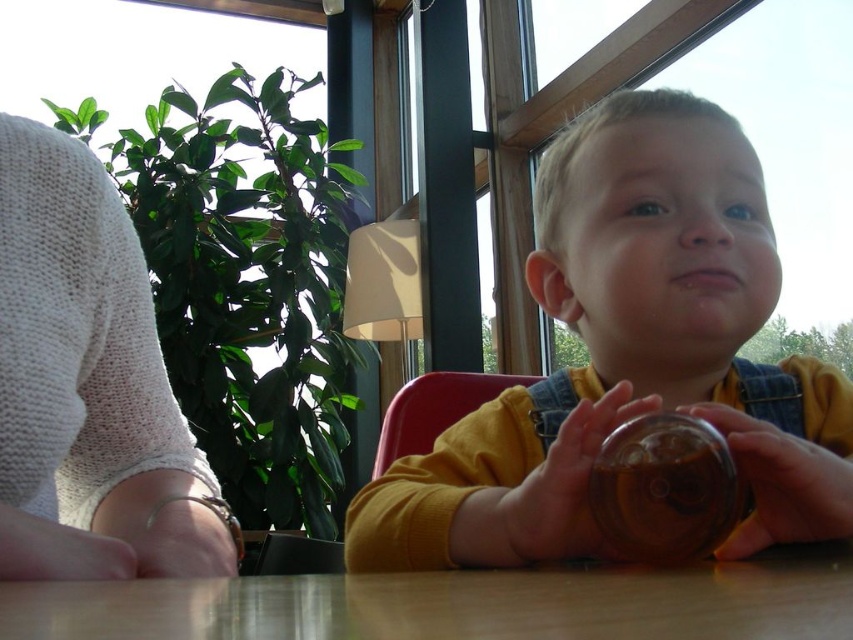
Which of these two, wooden table at center or translucent plastic cup at lower center, stands taller?

translucent plastic cup at lower center is taller.

Is point (80, 595) positioned in front of point (693, 497)?

Yes, point (80, 595) is in front of point (693, 497).

Is point (49, 586) positioned behind point (608, 470)?

No, (49, 586) is closer to viewer.

Locate an element on the screen. wooden table at center is located at coordinates (460, 604).

Based on the photo, does matte yellow shirt at center appear over red plastic chair at center?

Yes, matte yellow shirt at center is above red plastic chair at center.

This screenshot has height=640, width=853. Describe the element at coordinates (630, 355) in the screenshot. I see `matte yellow shirt at center` at that location.

The height and width of the screenshot is (640, 853). I want to click on matte yellow shirt at center, so click(x=630, y=355).

Which of these two, wooden table at center or translucent glass cup at center, stands taller?

Standing taller between the two is translucent glass cup at center.

Does point (833, 582) come behind point (767, 440)?

No, (833, 582) is in front of (767, 440).

The width and height of the screenshot is (853, 640). What are the coordinates of `wooden table at center` in the screenshot? It's located at click(460, 604).